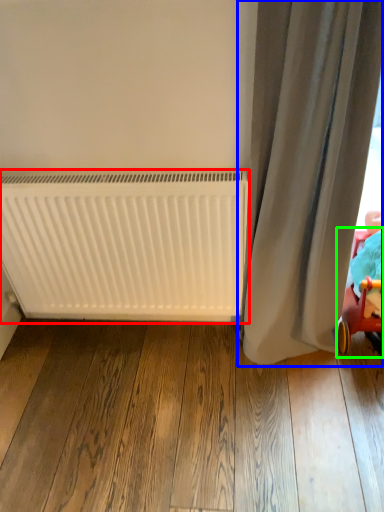
Question: Considering the real-world distances, which object is closest to radiator (highlighted by a red box)? curtain (highlighted by a blue box) or baby carriage (highlighted by a green box).

Choices:
 (A) curtain
 (B) baby carriage

Answer: (A)